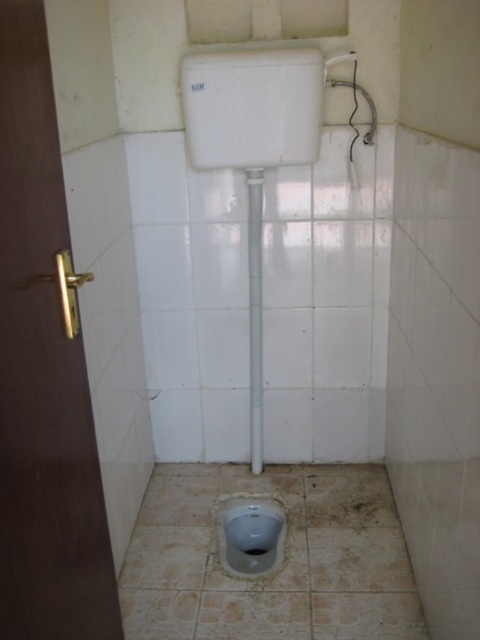
You are a maintenance worker inspecting the bathroom stall. You notice two fixtures, the matte gray toilet bowl at lower center and the gray matte urinal at center. Which one requires more space to install due to its size?

The matte gray toilet bowl at lower center requires more space to install because it is larger in size than the gray matte urinal at center.

You are a maintenance worker in a public restroom. You need to inspect both the matte gray toilet bowl at lower center and the gray matte urinal at center. Which one is located higher up in the stall?

The matte gray toilet bowl at lower center is positioned over the gray matte urinal at center, so it is higher up in the stall.

You are standing in front of the bathroom stall and want to flush the matte gray toilet bowl at lower center. If your arm can reach 5 feet, can you comfortably reach the flush tank without moving closer?

The matte gray toilet bowl at lower center is 5.67 feet away from the viewer. Since your arm can only reach 5 feet, you cannot comfortably reach the flush tank without moving closer.